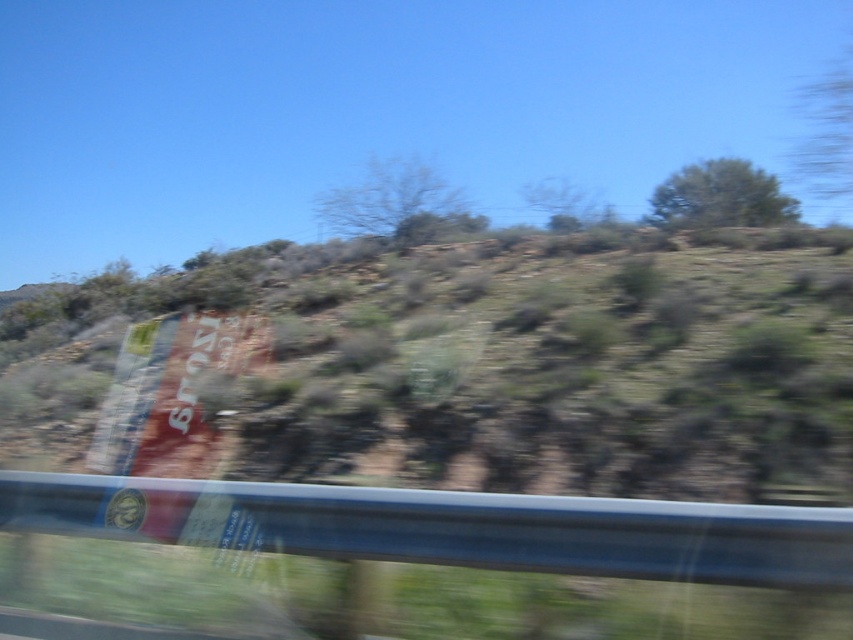
Question: Which object appears farthest from the camera in this image?

Choices:
 (A) green shrubbery at center
 (B) transparent glass car window at lower left

Answer: (A)

Question: Is green shrubbery at center closer to camera compared to transparent glass car window at lower left?

Choices:
 (A) yes
 (B) no

Answer: (B)

Question: Does green shrubbery at center appear on the right side of transparent glass car window at lower left?

Choices:
 (A) no
 (B) yes

Answer: (A)

Question: Does green shrubbery at center have a larger size compared to transparent glass car window at lower left?

Choices:
 (A) yes
 (B) no

Answer: (A)